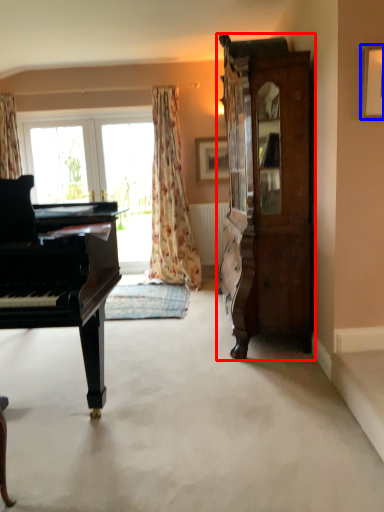
Question: Which of the following is the farthest to the observer, cabinetry (highlighted by a red box) or picture frame (highlighted by a blue box)?

Choices:
 (A) cabinetry
 (B) picture frame

Answer: (A)